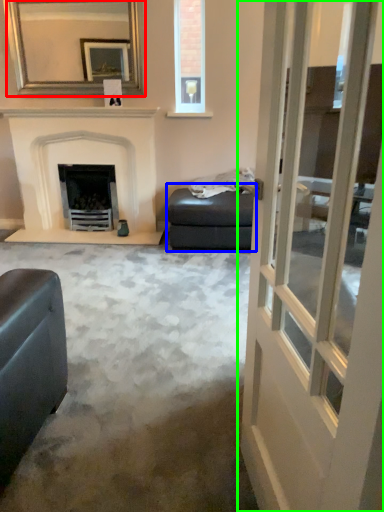
Question: Which object is positioned farthest from mirror (highlighted by a red box)? Select from footrest (highlighted by a blue box) and door (highlighted by a green box).

Choices:
 (A) footrest
 (B) door

Answer: (B)